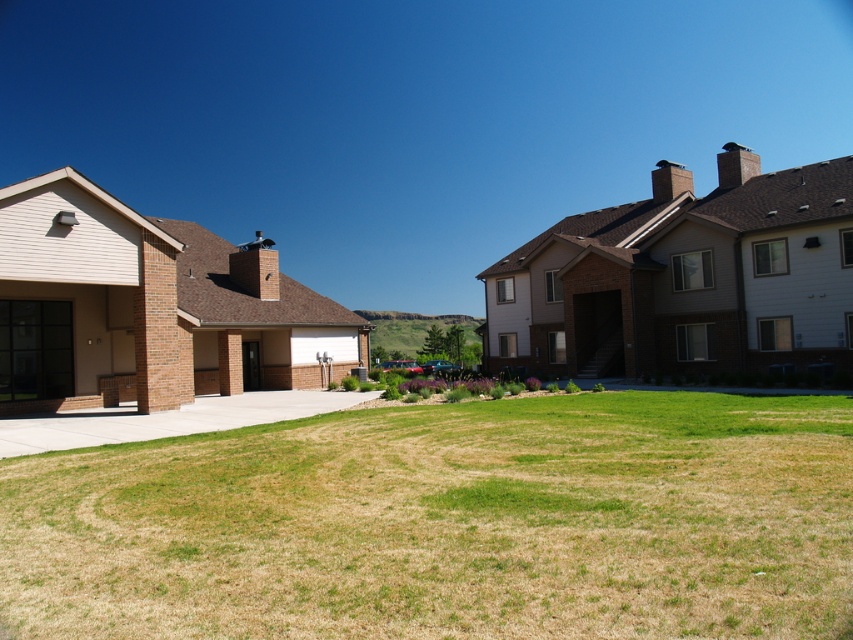
Question: Does green grass at center appear over brown wood garage at right?

Choices:
 (A) no
 (B) yes

Answer: (A)

Question: Which point is closer to the camera?

Choices:
 (A) (410, 536)
 (B) (554, 298)
 (C) (317, 410)

Answer: (A)

Question: Does brown wood garage at right appear on the right side of beige brick garage at left?

Choices:
 (A) no
 (B) yes

Answer: (B)

Question: Can you confirm if brown wood garage at right is positioned to the right of beige brick garage at left?

Choices:
 (A) yes
 (B) no

Answer: (A)

Question: Estimate the real-world distances between objects in this image. Which object is farther from the brown wood garage at right?

Choices:
 (A) green grass at center
 (B) concrete at center
 (C) beige brick garage at left

Answer: (A)

Question: Which point is closer to the camera?

Choices:
 (A) (286, 291)
 (B) (761, 234)
 (C) (42, 444)

Answer: (C)